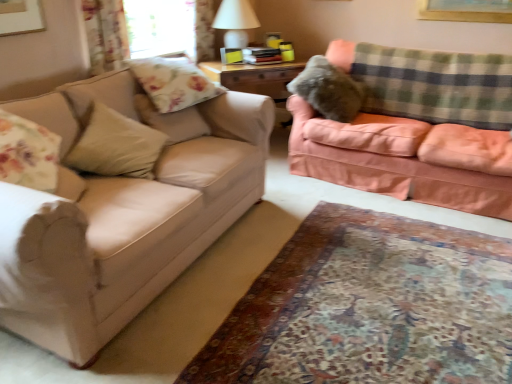
Question: Would you say white matte table lamp at upper center is outside carpet at lower center?

Choices:
 (A) no
 (B) yes

Answer: (B)

Question: Is white matte table lamp at upper center at the right side of carpet at lower center?

Choices:
 (A) no
 (B) yes

Answer: (A)

Question: Is white matte table lamp at upper center behind carpet at lower center?

Choices:
 (A) no
 (B) yes

Answer: (B)

Question: Considering the relative sizes of white matte table lamp at upper center and carpet at lower center in the image provided, is white matte table lamp at upper center smaller than carpet at lower center?

Choices:
 (A) yes
 (B) no

Answer: (A)

Question: Is white matte table lamp at upper center wider than carpet at lower center?

Choices:
 (A) yes
 (B) no

Answer: (B)

Question: Do you think matte beige couch at left, the 2th studio couch viewed from the right, is within carpet at lower center, or outside of it?

Choices:
 (A) inside
 (B) outside

Answer: (B)

Question: Is point (51, 248) positioned closer to the camera than point (356, 251)?

Choices:
 (A) closer
 (B) farther

Answer: (A)

Question: In the image, is matte beige couch at left, the 2th studio couch viewed from the right, positioned in front of or behind carpet at lower center?

Choices:
 (A) behind
 (B) front

Answer: (A)

Question: Considering the positions of matte beige couch at left, the 2th studio couch viewed from the right, and carpet at lower center in the image, is matte beige couch at left, the 2th studio couch viewed from the right, wider or thinner than carpet at lower center?

Choices:
 (A) wide
 (B) thin

Answer: (B)

Question: Is point (222, 3) closer or farther from the camera than point (438, 188)?

Choices:
 (A) farther
 (B) closer

Answer: (A)

Question: In the image, is white matte table lamp at upper center positioned in front of or behind peach velvety couch at right, the second studio couch viewed from the left?

Choices:
 (A) behind
 (B) front

Answer: (A)

Question: Considering the relative positions of white matte table lamp at upper center and peach velvety couch at right, the second studio couch viewed from the left, in the image provided, is white matte table lamp at upper center to the left or to the right of peach velvety couch at right, the second studio couch viewed from the left,?

Choices:
 (A) left
 (B) right

Answer: (A)

Question: Considering the positions of white matte table lamp at upper center and peach velvety couch at right, the first studio couch when ordered from right to left, in the image, is white matte table lamp at upper center wider or thinner than peach velvety couch at right, the first studio couch when ordered from right to left,?

Choices:
 (A) wide
 (B) thin

Answer: (B)

Question: Is point (398, 148) closer or farther from the camera than point (442, 92)?

Choices:
 (A) closer
 (B) farther

Answer: (A)

Question: Is peach velvety couch at right, the second studio couch viewed from the left, situated inside green plaid blanket at upper right or outside?

Choices:
 (A) outside
 (B) inside

Answer: (A)